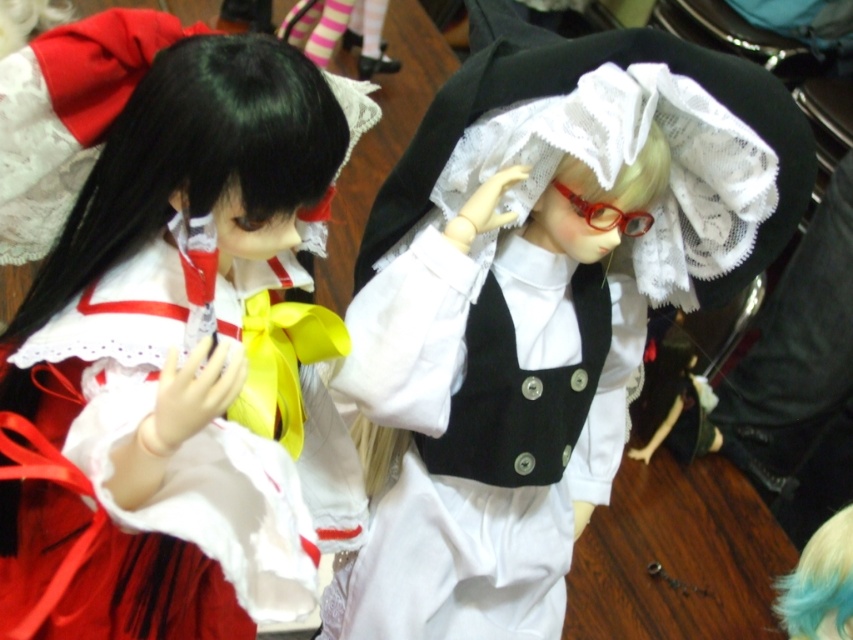
You are a photographer setting up a shoot in the scene described. You need to place a spotlight on the white lace dress at center without casting a shadow on the blue fabric hair at upper right. Is this possible given their positions?

The white lace dress at center is positioned over the blue fabric hair at upper right, so placing a spotlight on the white lace dress at center would cast a shadow on the blue fabric hair at upper right unless the light is placed directly behind or in line with the blue fabric hair at upper right to avoid obstruction.

You are a photographer setting up for a photoshoot and need to position a light source to the left of the matte white dress at center. Based on the scene description, where should you place the light source relative to the other objects in the image?

The matte white dress at center is located at point (x=163, y=337), so you should place the light source to the left of that coordinate to ensure proper lighting without casting shadows from other objects.

You are a photographer setting up a shoot in the scene. You need to place a spotlight on the white lace dress at center and another on the blue fabric hair at upper right. Which spotlight should be placed to the left of the other?

The white lace dress at center should be placed to the left of the blue fabric hair at upper right because the white lace dress at center is positioned on the left side of blue fabric hair at upper right.